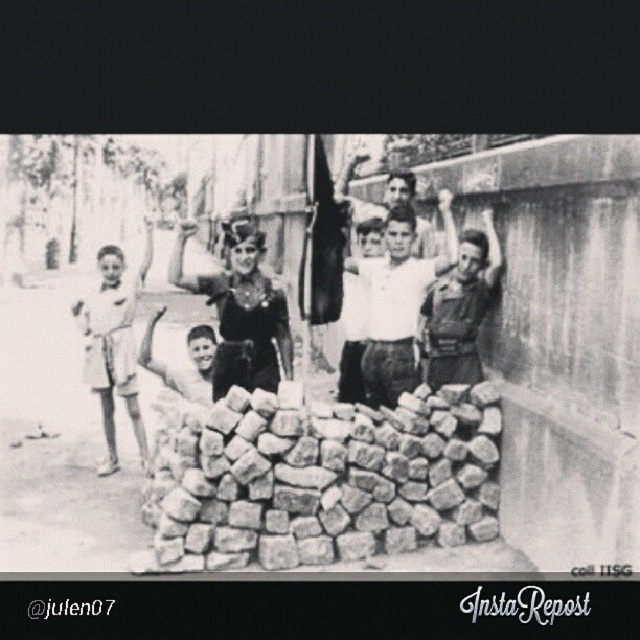
Question: Among these points, which one is farthest from the camera?

Choices:
 (A) (177, 380)
 (B) (132, 282)
 (C) (378, 266)

Answer: (B)

Question: Is light beige shorts at left to the right of smooth skin boy at center from the viewer's perspective?

Choices:
 (A) yes
 (B) no

Answer: (B)

Question: Which object appears closest to the camera in this image?

Choices:
 (A) matte black uniform at right
 (B) light beige shorts at left
 (C) white cotton shirt at center
 (D) smooth skin boy at center

Answer: (A)

Question: Can you confirm if light beige shorts at left is positioned to the right of smooth skin boy at center?

Choices:
 (A) no
 (B) yes

Answer: (A)

Question: Among these objects, which one is farthest from the camera?

Choices:
 (A) smooth skin boy at center
 (B) matte black uniform at right
 (C) white cotton shirt at center

Answer: (A)

Question: Observing the image, what is the correct spatial positioning of white cotton shirt at center in reference to smooth fabric shirt at center?

Choices:
 (A) below
 (B) above

Answer: (A)